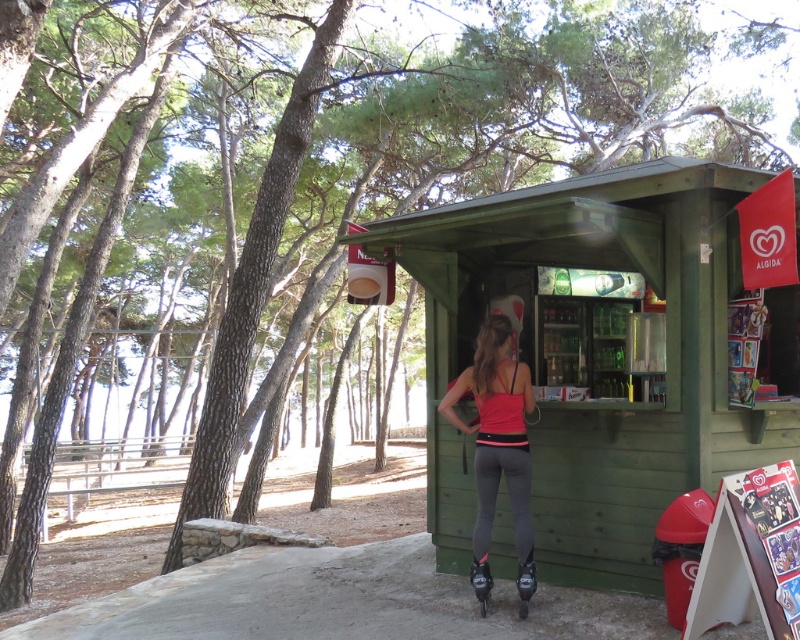
Between point (486, 416) and point (482, 605), which one is positioned in front?

Point (482, 605) is more forward.

Locate an element on the screen. The height and width of the screenshot is (640, 800). matte pink tank top at center is located at coordinates (496, 432).

Who is lower down, green wooden hut at center or matte pink tank top at center?

Positioned lower is matte pink tank top at center.

Which is more to the right, green wooden hut at center or matte pink tank top at center?

green wooden hut at center is more to the right.

Find the location of a particular element. green wooden hut at center is located at coordinates (598, 355).

Does green wooden hut at center have a greater height compared to black matte roller skates at lower center?

Indeed, green wooden hut at center has a greater height compared to black matte roller skates at lower center.

Can you confirm if green wooden hut at center is bigger than black matte roller skates at lower center?

Yes.

The width and height of the screenshot is (800, 640). Identify the location of green wooden hut at center. pyautogui.click(x=598, y=355).